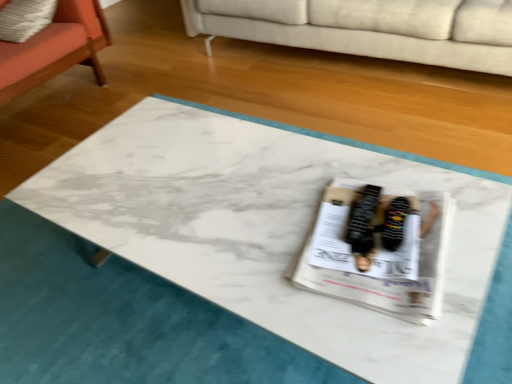
At what (x,y) coordinates should I click in order to perform the action: click on free location in front of white glossy magazine at center. Please return your answer as a coordinate pair (x, y). This screenshot has height=384, width=512. Looking at the image, I should click on (395, 330).